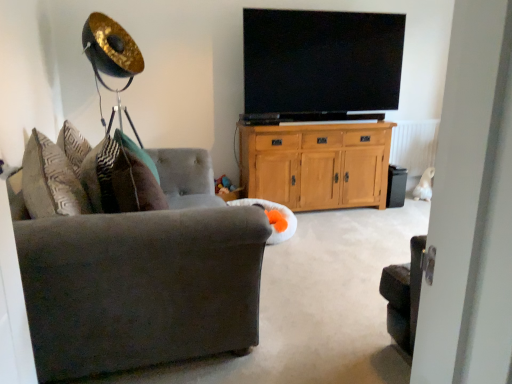
Question: Is flat-screen tv at upper center at the back of light oak cabinet at center?

Choices:
 (A) yes
 (B) no

Answer: (B)

Question: Is light oak cabinet at center thinner than flat-screen tv at upper center?

Choices:
 (A) yes
 (B) no

Answer: (B)

Question: Considering the relative positions of light oak cabinet at center and flat-screen tv at upper center in the image provided, is light oak cabinet at center in front of flat-screen tv at upper center?

Choices:
 (A) no
 (B) yes

Answer: (A)

Question: Is light oak cabinet at center shorter than flat-screen tv at upper center?

Choices:
 (A) yes
 (B) no

Answer: (A)

Question: Is light oak cabinet at center far from flat-screen tv at upper center?

Choices:
 (A) no
 (B) yes

Answer: (A)

Question: Looking at the image, does white soft bean bag at center seem bigger or smaller compared to velvet gray couch at left?

Choices:
 (A) small
 (B) big

Answer: (A)

Question: Would you say white soft bean bag at center is inside or outside velvet gray couch at left?

Choices:
 (A) outside
 (B) inside

Answer: (A)

Question: Is point (288, 238) closer or farther from the camera than point (37, 195)?

Choices:
 (A) farther
 (B) closer

Answer: (A)

Question: From the image's perspective, is white soft bean bag at center above or below velvet gray couch at left?

Choices:
 (A) above
 (B) below

Answer: (B)

Question: From the image's perspective, is black matte speaker at lower right positioned above or below velvet gray couch at left?

Choices:
 (A) above
 (B) below

Answer: (A)

Question: Visually, is black matte speaker at lower right positioned to the left or to the right of velvet gray couch at left?

Choices:
 (A) left
 (B) right

Answer: (B)

Question: Is black matte speaker at lower right inside or outside of velvet gray couch at left?

Choices:
 (A) outside
 (B) inside

Answer: (A)

Question: In the image, is black matte speaker at lower right positioned in front of or behind velvet gray couch at left?

Choices:
 (A) front
 (B) behind

Answer: (B)

Question: From a real-world perspective, is black matte speaker at lower right positioned above or below flat-screen tv at upper center?

Choices:
 (A) above
 (B) below

Answer: (B)

Question: Considering the positions of black matte speaker at lower right and flat-screen tv at upper center in the image, is black matte speaker at lower right bigger or smaller than flat-screen tv at upper center?

Choices:
 (A) big
 (B) small

Answer: (B)